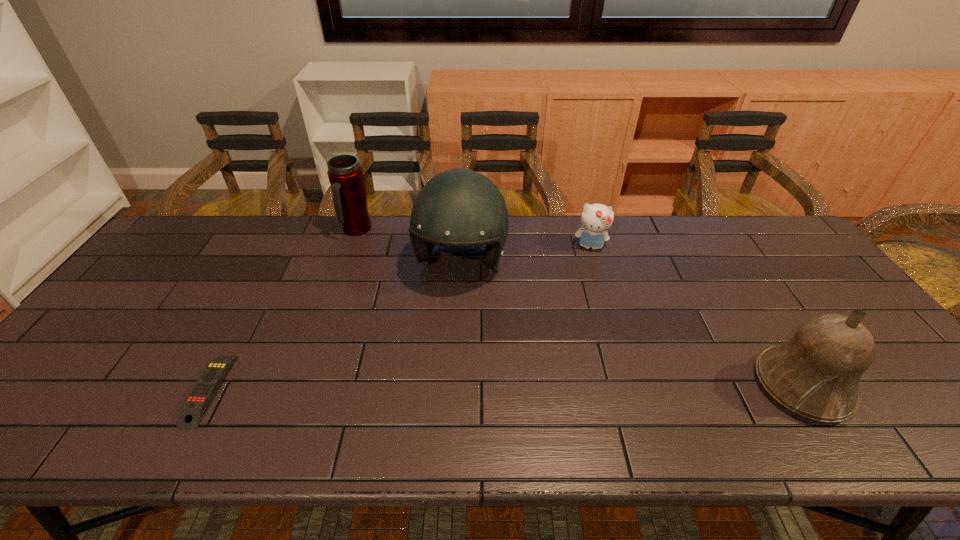
Where is `vacant space on the desktop that is between the remote control and the bell and is positioned at the face opening of the third object from right to left`? The image size is (960, 540). vacant space on the desktop that is between the remote control and the bell and is positioned at the face opening of the third object from right to left is located at coordinates (421, 389).

What are the coordinates of `vacant space on the desktop that is between the remote control and the rightmost object and is positioned on the side with the handle of the fourth object from right to left` in the screenshot? It's located at (431, 389).

Locate an element on the screen. The height and width of the screenshot is (540, 960). vacant space on the desktop that is between the leftmost object and the bell and is positioned on the front-facing side of the fourth object from left to right is located at coordinates (579, 388).